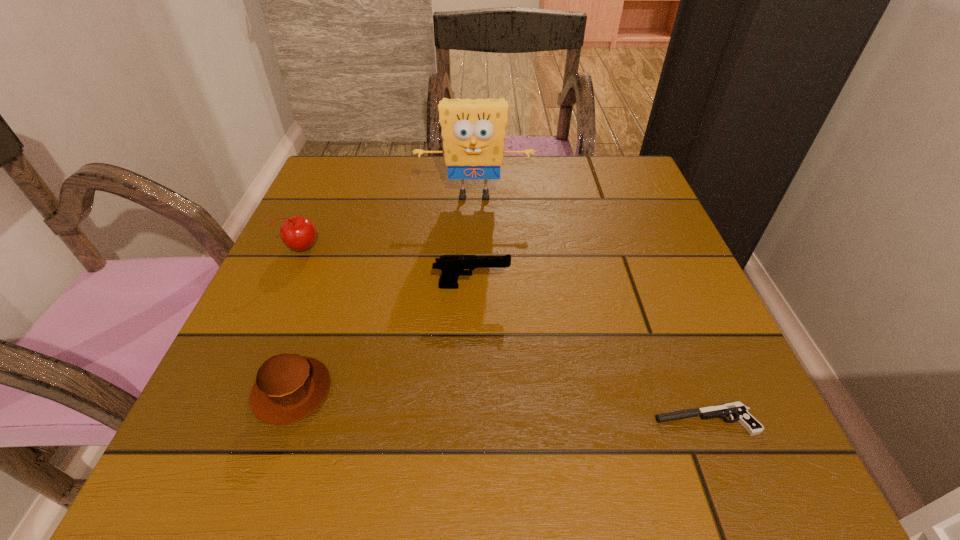
Where is `object that is positioned at the right edge`? This screenshot has width=960, height=540. object that is positioned at the right edge is located at coordinates (737, 409).

Where is `object located in the near left corner section of the desktop`? object located in the near left corner section of the desktop is located at coordinates (289, 387).

The image size is (960, 540). Identify the location of object located at the near right corner. (x=737, y=409).

Locate an element on the screen. vacant space at the far edge of the desktop is located at coordinates (400, 157).

Where is `free location at the near edge`? The height and width of the screenshot is (540, 960). free location at the near edge is located at coordinates (656, 447).

In the image, there is a desktop. Identify the location of free space at the left edge. This screenshot has height=540, width=960. click(300, 292).

The width and height of the screenshot is (960, 540). What are the coordinates of `vacant region at the right edge of the desktop` in the screenshot? It's located at (652, 295).

This screenshot has width=960, height=540. In the image, there is a desktop. Find the location of `vacant region at the far left corner`. vacant region at the far left corner is located at coordinates (345, 203).

Identify the location of blank space at the near left corner. This screenshot has width=960, height=540. (276, 434).

Identify the location of free location at the far right corner of the desktop. The height and width of the screenshot is (540, 960). (606, 199).